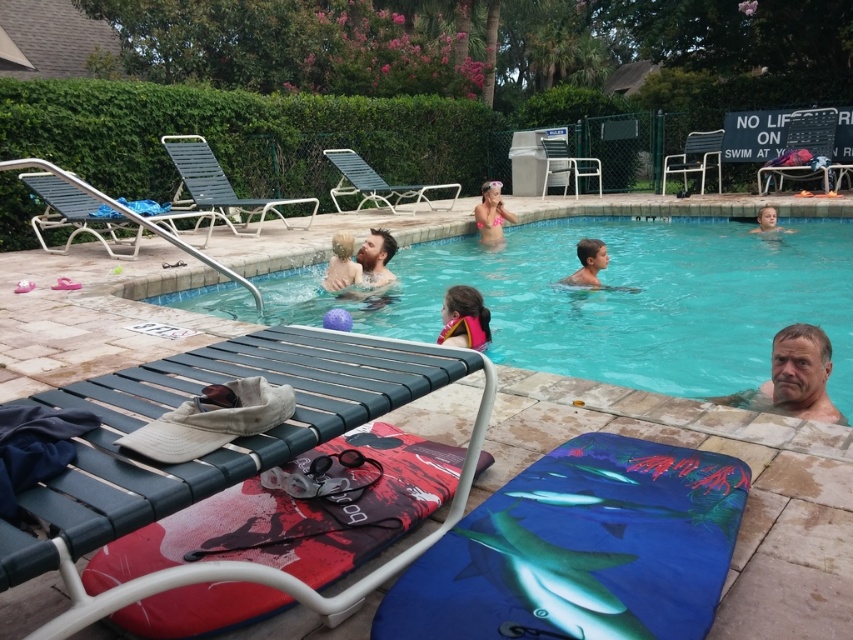
Question: Is smooth skin at upper right thinner than pink life vest at center?

Choices:
 (A) no
 (B) yes

Answer: (A)

Question: Which is farther from the light brown hair at upper right?

Choices:
 (A) brown hair at upper center
 (B) red fabric daybed at lower left
 (C) blue fabric surfboard at lower right
 (D) smooth skin man at center

Answer: (B)

Question: Among these objects, which one is nearest to the camera?

Choices:
 (A) pink life vest at center
 (B) pink fabric bikini at upper center

Answer: (A)

Question: Is the position of blue fabric surfboard at lower right less distant than that of smooth skin at upper right?

Choices:
 (A) yes
 (B) no

Answer: (A)

Question: Which object appears farthest from the camera in this image?

Choices:
 (A) smooth skin at upper right
 (B) brown hair at upper center
 (C) light brown hair at upper right
 (D) blue fabric surfboard at lower right

Answer: (C)

Question: Is blue plastic pool at center below red fabric daybed at lower left?

Choices:
 (A) yes
 (B) no

Answer: (B)